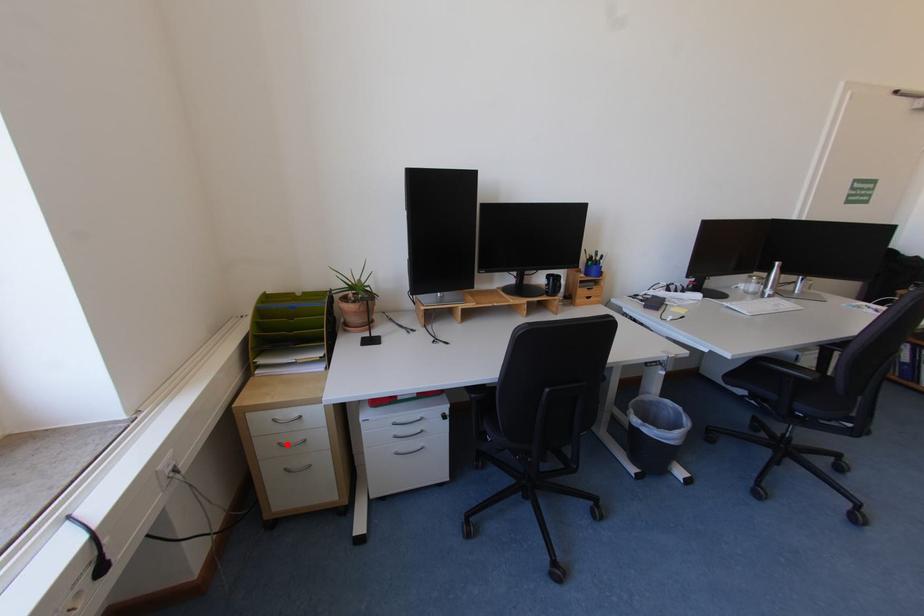
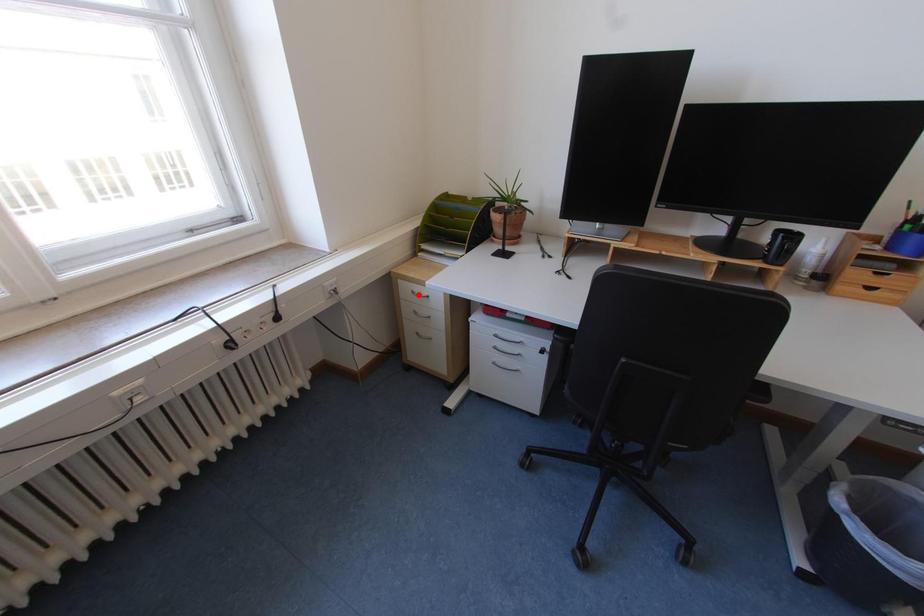
I am providing you with two images of the same scene from different viewpoints. A red point is marked on the first image and another point is marked on the second image. Are the points marked in image1 and image2 representing the same 3D position?

No